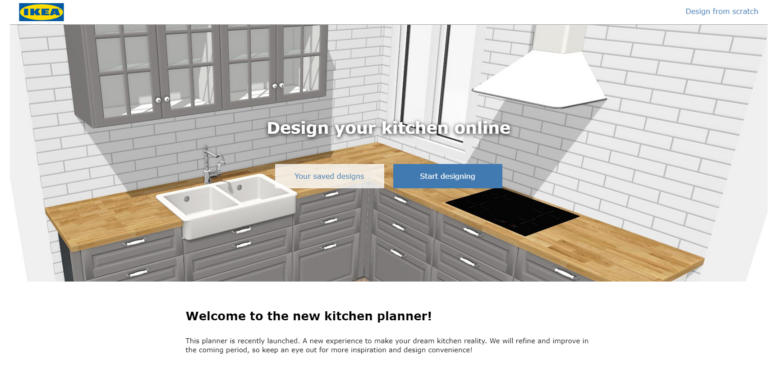
You are a GUI agent. You are given a task and a screenshot of the screen. Output one action in this format:
    pyautogui.click(x=<x>, y=<y>)
    Task: Click on the brick background
    The image size is (768, 382).
    Given the screenshot: What is the action you would take?
    pyautogui.click(x=653, y=96)